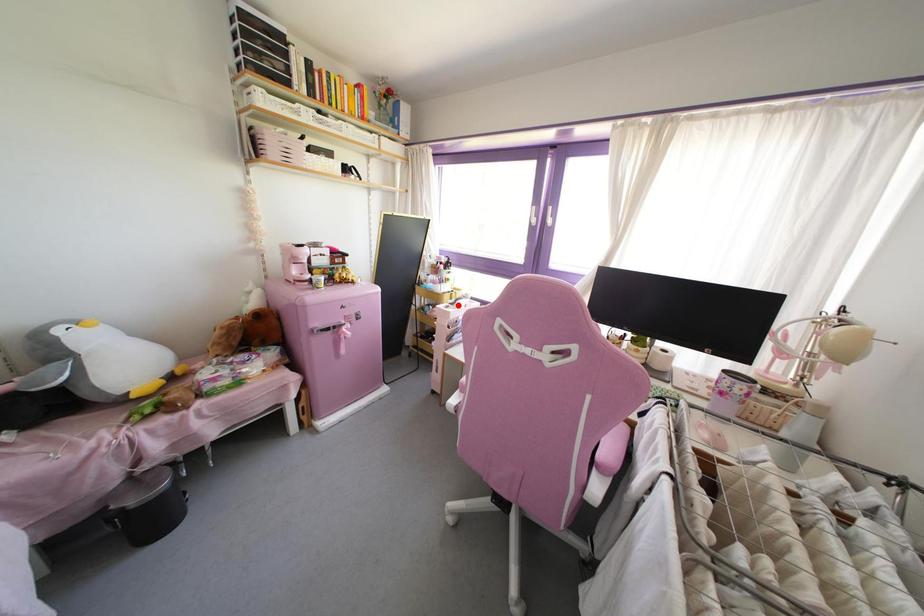
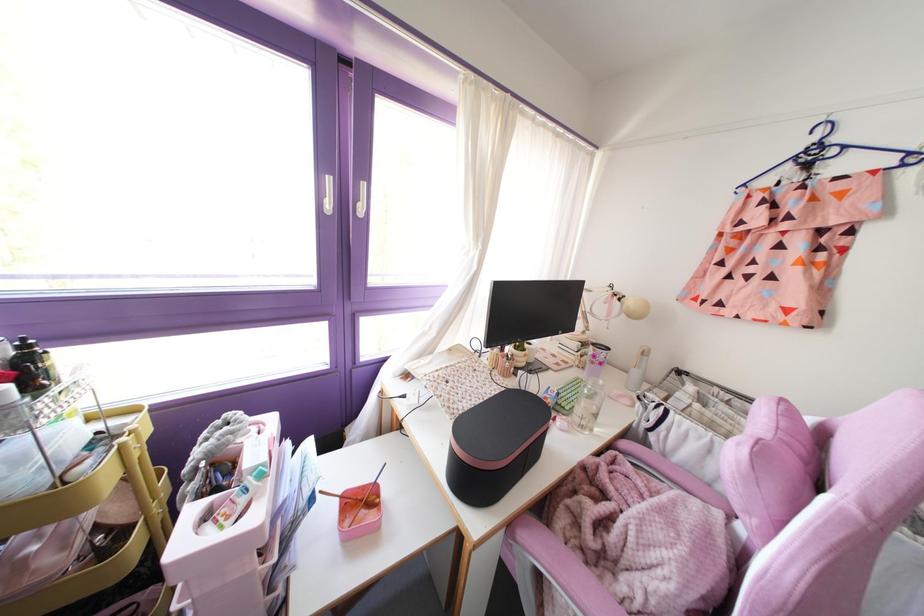
In the second image, find the point that corresponds to the highlighted location in the first image.

(261, 475)